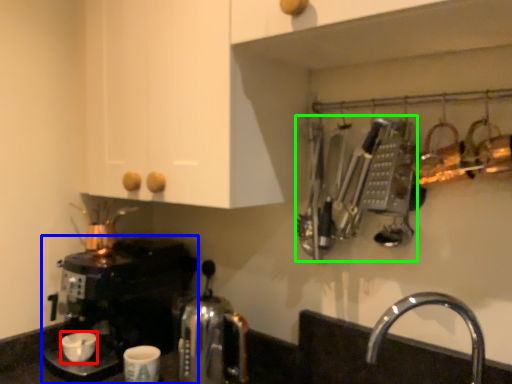
Question: Which object is the farthest from coffee cup (highlighted by a red box)? Choose among these: coffee maker (highlighted by a blue box) or cutlery (highlighted by a green box).

Choices:
 (A) coffee maker
 (B) cutlery

Answer: (B)